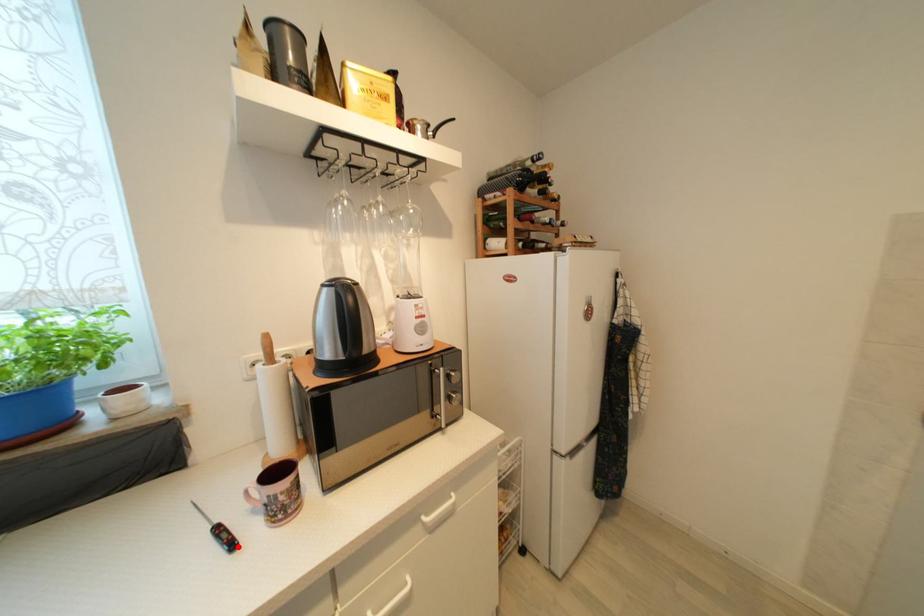
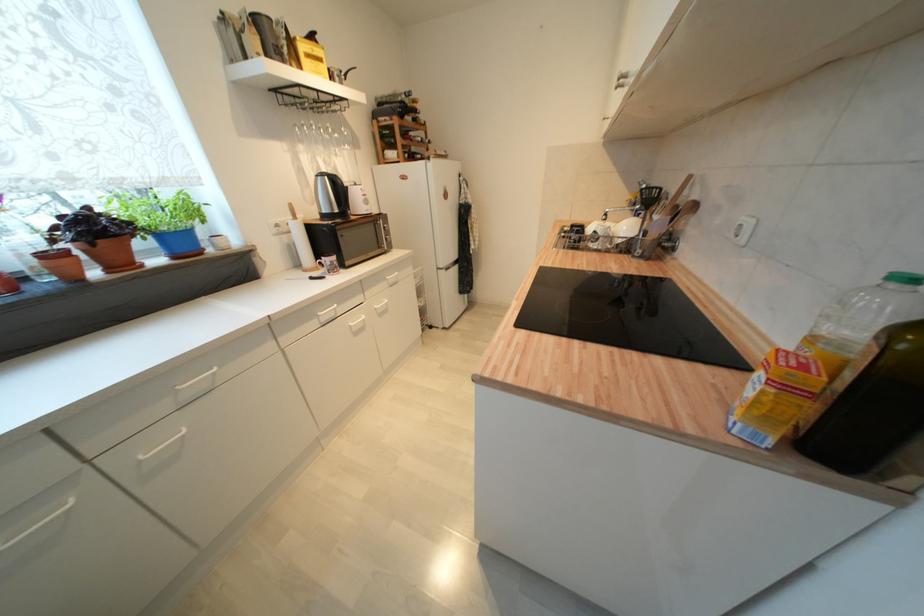
The point at the highlighted location is marked in the first image. Where is the corresponding point in the second image?

(329, 280)